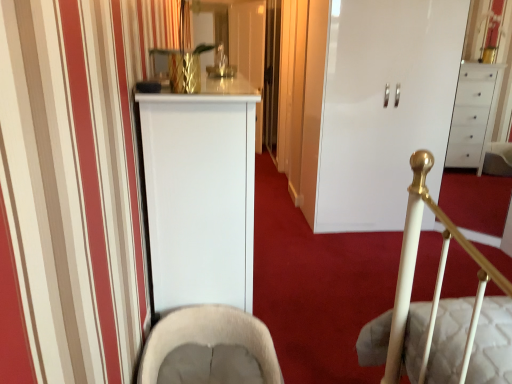
Measure the distance between white glossy cabinet at center and camera.

The depth of white glossy cabinet at center is 9.56 feet.

What do you see at coordinates (377, 106) in the screenshot? The height and width of the screenshot is (384, 512). I see `white glossy cabinet at center` at bounding box center [377, 106].

The image size is (512, 384). I want to click on white glossy cabinet at center, so click(x=377, y=106).

Measure the distance between point (221, 319) and camera.

Point (221, 319) and camera are 2.04 meters apart from each other.

What do you see at coordinates (209, 348) in the screenshot? Image resolution: width=512 pixels, height=384 pixels. I see `beige fabric rocking chair at lower center` at bounding box center [209, 348].

Identify the location of beige fabric rocking chair at lower center. This screenshot has height=384, width=512. (209, 348).

This screenshot has width=512, height=384. I want to click on white glossy cabinet at center, so click(377, 106).

Which is more to the right, white glossy cabinet at center or beige fabric rocking chair at lower center?

white glossy cabinet at center is more to the right.

Relative to beige fabric rocking chair at lower center, is white glossy cabinet at center in front or behind?

white glossy cabinet at center is behind beige fabric rocking chair at lower center.

Considering the positions of points (321, 38) and (213, 375), is point (321, 38) farther from camera compared to point (213, 375)?

Yes, it is.

From the image's perspective, would you say white glossy cabinet at center is positioned over beige fabric rocking chair at lower center?

Yes.

From a real-world perspective, which object rests below the other?

beige fabric rocking chair at lower center.

Can you confirm if white glossy cabinet at center is wider than beige fabric rocking chair at lower center?

Correct, the width of white glossy cabinet at center exceeds that of beige fabric rocking chair at lower center.

Consider the image. Considering the sizes of objects white glossy cabinet at center and beige fabric rocking chair at lower center in the image provided, who is taller, white glossy cabinet at center or beige fabric rocking chair at lower center?

white glossy cabinet at center.

Which of these two, white glossy cabinet at center or beige fabric rocking chair at lower center, is bigger?

white glossy cabinet at center.

Is white glossy cabinet at center inside or outside of beige fabric rocking chair at lower center?

white glossy cabinet at center cannot be found inside beige fabric rocking chair at lower center.

Is white glossy cabinet at center far from beige fabric rocking chair at lower center?

That's right, there is a large distance between white glossy cabinet at center and beige fabric rocking chair at lower center.

Could you tell me if white glossy cabinet at center is facing beige fabric rocking chair at lower center?

No.

How many degrees apart are the facing directions of white glossy cabinet at center and beige fabric rocking chair at lower center?

91.4 degrees.

Measure the distance from white glossy cabinet at center to beige fabric rocking chair at lower center.

white glossy cabinet at center and beige fabric rocking chair at lower center are 1.85 meters apart from each other.

The height and width of the screenshot is (384, 512). Find the location of `door on the right of beige fabric rocking chair at lower center`. door on the right of beige fabric rocking chair at lower center is located at coordinates (377, 106).

Is beige fabric rocking chair at lower center to the right of white glossy cabinet at center from the viewer's perspective?

No.

Relative to white glossy cabinet at center, is beige fabric rocking chair at lower center in front or behind?

beige fabric rocking chair at lower center is in front of white glossy cabinet at center.

Is point (156, 373) less distant than point (350, 87)?

Yes, point (156, 373) is in front of point (350, 87).

From the image's perspective, who appears lower, beige fabric rocking chair at lower center or white glossy cabinet at center?

beige fabric rocking chair at lower center is shown below in the image.

From a real-world perspective, which is physically below, beige fabric rocking chair at lower center or white glossy cabinet at center?

In real-world perspective, beige fabric rocking chair at lower center is lower.

Which of these two, beige fabric rocking chair at lower center or white glossy cabinet at center, is thinner?

beige fabric rocking chair at lower center is thinner.

Considering the relative sizes of beige fabric rocking chair at lower center and white glossy cabinet at center in the image provided, is beige fabric rocking chair at lower center taller than white glossy cabinet at center?

In fact, beige fabric rocking chair at lower center may be shorter than white glossy cabinet at center.

Is beige fabric rocking chair at lower center bigger than white glossy cabinet at center?

No, beige fabric rocking chair at lower center is not bigger than white glossy cabinet at center.

Does beige fabric rocking chair at lower center contain white glossy cabinet at center?

That's incorrect, white glossy cabinet at center is not inside beige fabric rocking chair at lower center.

Is beige fabric rocking chair at lower center touching white glossy cabinet at center?

No, beige fabric rocking chair at lower center is not in contact with white glossy cabinet at center.

Could you tell me if beige fabric rocking chair at lower center is facing white glossy cabinet at center?

No, beige fabric rocking chair at lower center is not facing towards white glossy cabinet at center.

Identify the location of rocking chair located underneath the white glossy cabinet at center (from a real-world perspective). The width and height of the screenshot is (512, 384). (209, 348).

Image resolution: width=512 pixels, height=384 pixels. Find the location of `door above the beige fabric rocking chair at lower center (from a real-world perspective)`. door above the beige fabric rocking chair at lower center (from a real-world perspective) is located at coordinates (377, 106).

You are a GUI agent. You are given a task and a screenshot of the screen. Output one action in this format:
    pyautogui.click(x=<x>, y=<y>)
    Task: Click on the rocking chair to the left of white glossy cabinet at center
    This screenshot has height=384, width=512.
    Given the screenshot: What is the action you would take?
    pyautogui.click(x=209, y=348)